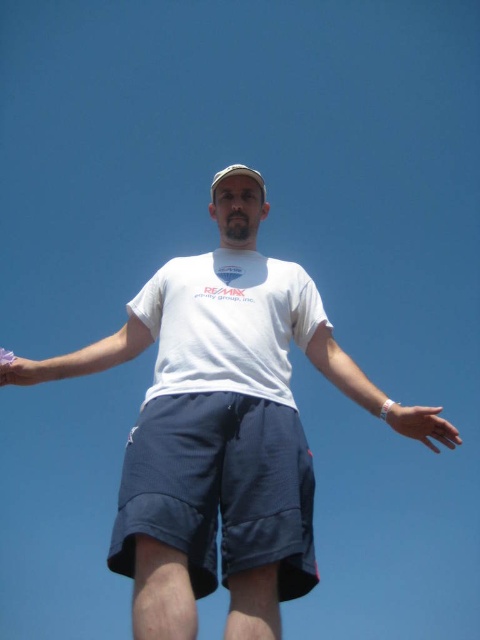
Question: Which of the following is the closest to the observer?

Choices:
 (A) white matte wristband at lower center
 (B) white matte arm at center

Answer: (B)

Question: Can you confirm if white cotton t-shirt at center is bigger than white fabric baseball hat at center?

Choices:
 (A) no
 (B) yes

Answer: (B)

Question: Which point appears closest to the camera in this image?

Choices:
 (A) (398, 424)
 (B) (32, 378)
 (C) (216, 180)

Answer: (A)

Question: Among these objects, which one is nearest to the camera?

Choices:
 (A) white matte arm at center
 (B) white matte wristband at lower center

Answer: (A)

Question: Does white cotton t-shirt at center appear on the right side of navy blue shorts at center?

Choices:
 (A) no
 (B) yes

Answer: (A)

Question: Observing the image, what is the correct spatial positioning of white matte t-shirt at center in reference to white fabric baseball hat at center?

Choices:
 (A) below
 (B) above

Answer: (A)